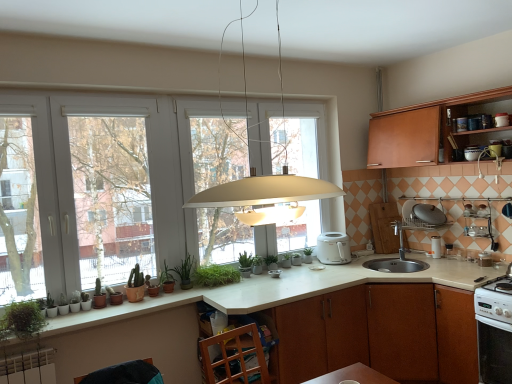
Locate an element on the screen. unoccupied space behind white plastic toaster at center, acting as the second appliance starting from the back is located at coordinates (275, 267).